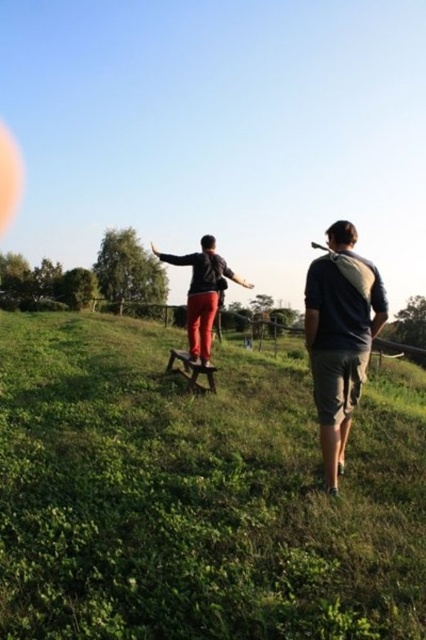
Question: Estimate the real-world distances between objects in this image. Which object is closer to the dark gray cotton shirt at right?

Choices:
 (A) matte black jacket at center
 (B) green grassy hillside at center

Answer: (B)

Question: Does dark gray cotton shirt at right appear under matte black jacket at center?

Choices:
 (A) yes
 (B) no

Answer: (A)

Question: Estimate the real-world distances between objects in this image. Which object is farther from the matte black jacket at center?

Choices:
 (A) dark gray cotton shirt at right
 (B) green grassy hillside at center

Answer: (A)

Question: Is dark gray cotton shirt at right bigger than matte black jacket at center?

Choices:
 (A) yes
 (B) no

Answer: (B)

Question: Which of the following is the farthest from the observer?

Choices:
 (A) matte black jacket at center
 (B) green grassy hillside at center

Answer: (A)

Question: Does green grassy hillside at center appear on the right side of matte black jacket at center?

Choices:
 (A) yes
 (B) no

Answer: (A)